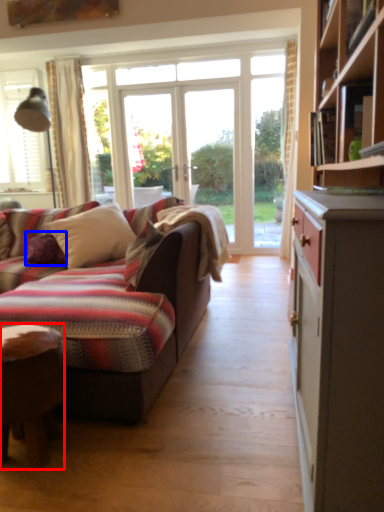
Question: Which of the following is the closest to the observer, desk (highlighted by a red box) or pillow (highlighted by a blue box)?

Choices:
 (A) desk
 (B) pillow

Answer: (A)